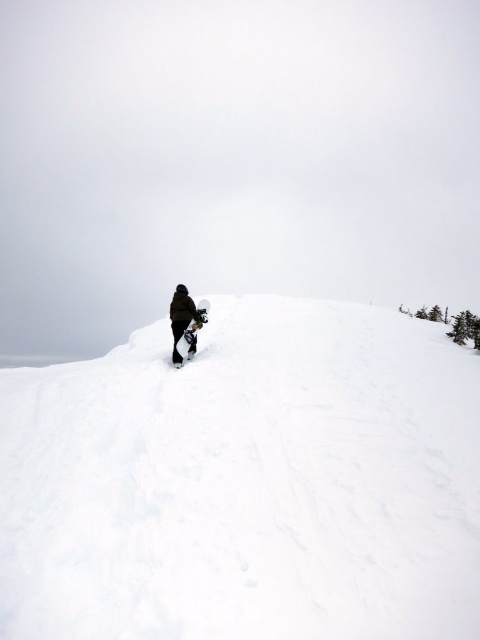
You are planning to build a snowman using the white fluffy snow at center and the dark brown snowboarder at center. Which object should you choose for the base of the snowman?

The white fluffy snow at center is wider than the dark brown snowboarder at center, so it is better to use the white fluffy snow at center for the base of the snowman since a wider base provides more stability.

You are planning to build a snowman using the white fluffy snow at center and the dark brown snowboarder at center. Which object can you use to form the base of the snowman?

The white fluffy snow at center can be used to form the base of the snowman since it is much taller than the dark brown snowboarder at center, providing a stable foundation.